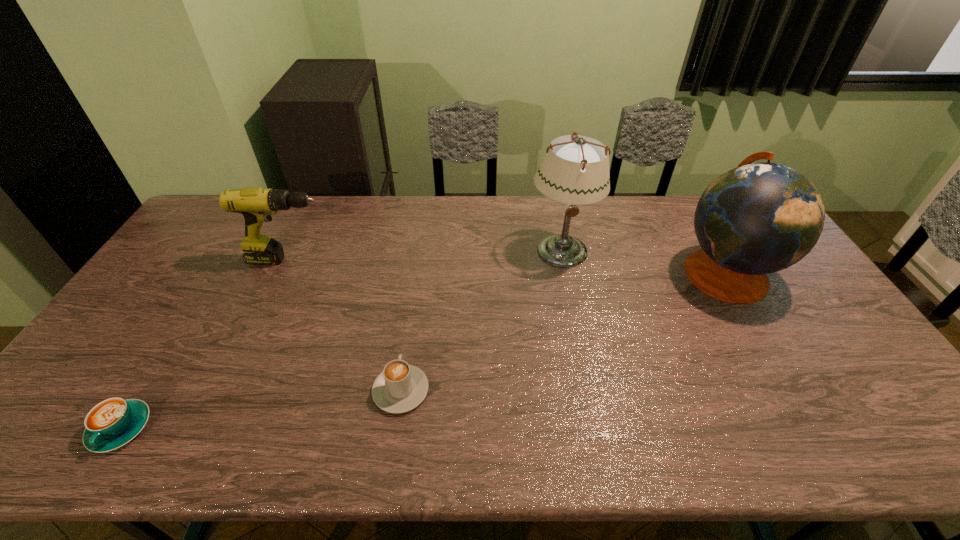
You are a GUI agent. You are given a task and a screenshot of the screen. Output one action in this format:
    pyautogui.click(x=<x>, y=<y>)
    Task: Click on the second object from right to left
    
    Given the screenshot: What is the action you would take?
    pyautogui.click(x=576, y=172)

At what (x,y) coordinates should I click in order to perform the action: click on the rightmost object. Please return your answer as a coordinate pair (x, y). The height and width of the screenshot is (540, 960). Looking at the image, I should click on (756, 219).

Where is `the third tallest object`? The height and width of the screenshot is (540, 960). the third tallest object is located at coordinates (257, 205).

In order to click on the second object from left to right in this screenshot , I will do `click(257, 205)`.

Locate an element on the screen. This screenshot has height=540, width=960. the third object from left to right is located at coordinates (400, 387).

The height and width of the screenshot is (540, 960). I want to click on the taller cappuccino, so click(400, 387).

Image resolution: width=960 pixels, height=540 pixels. Identify the location of the left cappuccino. (112, 423).

You are a GUI agent. You are given a task and a screenshot of the screen. Output one action in this format:
    pyautogui.click(x=<x>, y=<y>)
    Task: Click on the shortest object
    The image size is (960, 540).
    Given the screenshot: What is the action you would take?
    pyautogui.click(x=112, y=423)

Locate an element on the screen. The image size is (960, 540). vacant region located 0.060m on the lampshade of the lampshade is located at coordinates (568, 287).

Identify the location of vacant region located with the Americas facing the viewer on the rightmost object. (614, 272).